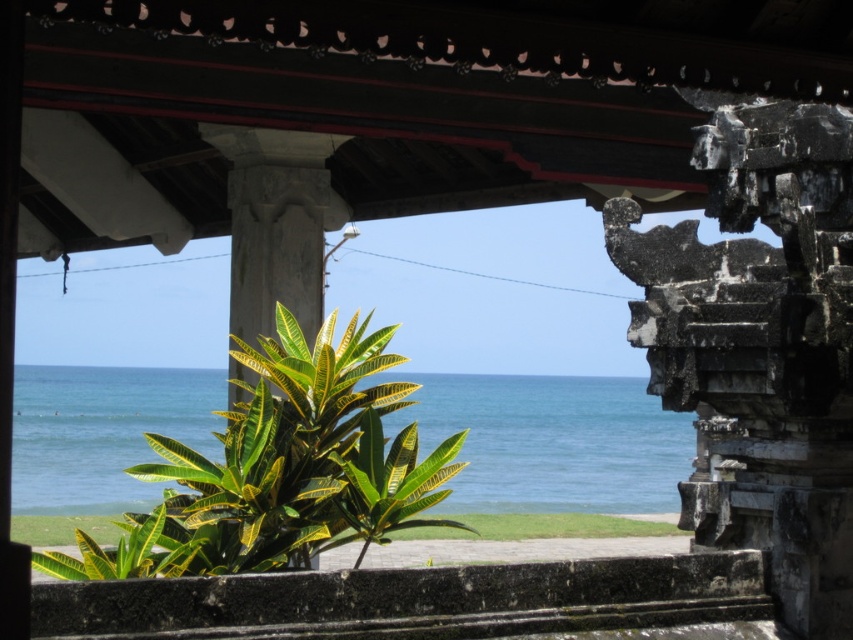
Question: Among these objects, which one is nearest to the camera?

Choices:
 (A) blue water at center
 (B) green leafy plant at center

Answer: (B)

Question: Which point is closer to the camera taking this photo?

Choices:
 (A) (428, 461)
 (B) (144, 497)

Answer: (A)

Question: Is blue water at center positioned in front of green leafy plant at center?

Choices:
 (A) yes
 (B) no

Answer: (B)

Question: Does blue water at center have a lesser width compared to green leafy plant at center?

Choices:
 (A) no
 (B) yes

Answer: (A)

Question: Does blue water at center have a lesser width compared to green leafy plant at center?

Choices:
 (A) yes
 (B) no

Answer: (B)